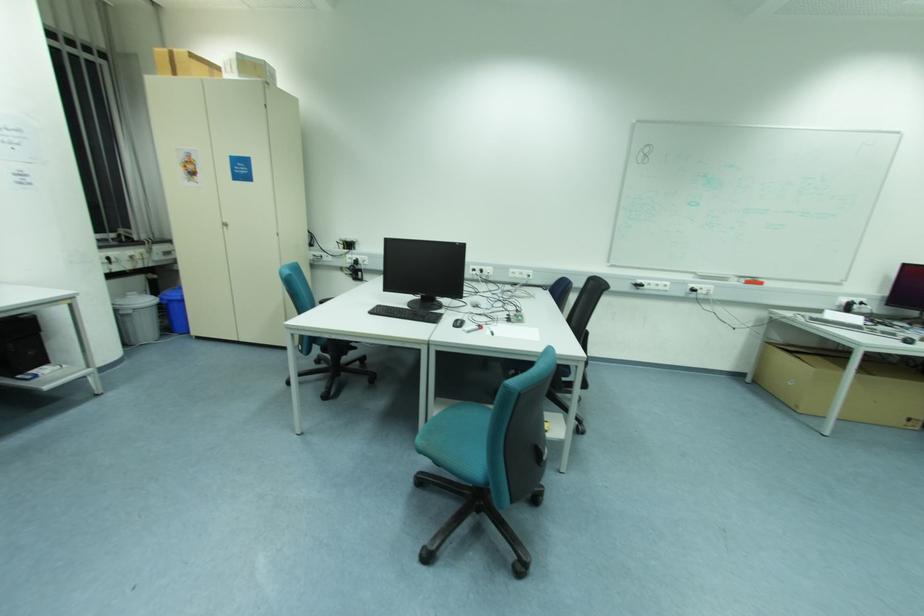
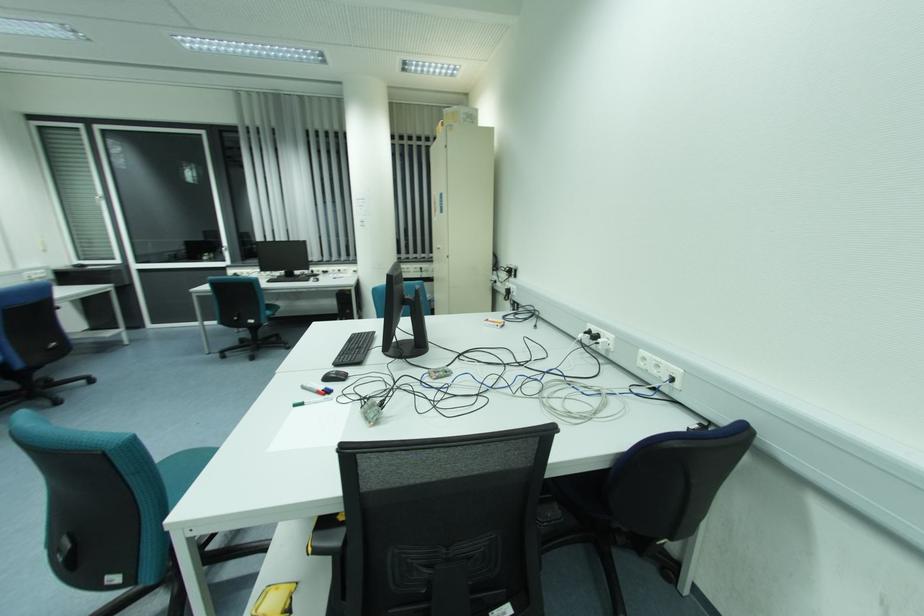
Find the pixel in the second image that matches (493,334) in the first image.

(296, 406)